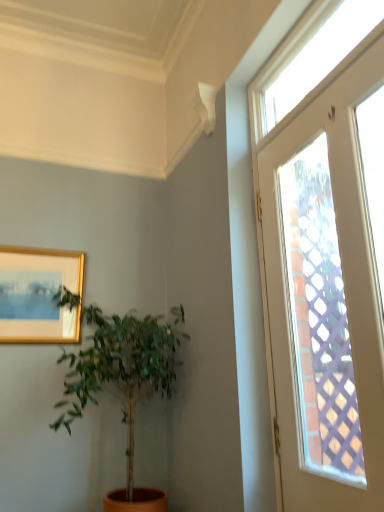
Question: From a real-world perspective, is clear glass door at upper right, the second window positioned from the top, above or below clear glass window at upper right, which is the first window in top-to-bottom order?

Choices:
 (A) below
 (B) above

Answer: (A)

Question: Is point (286, 404) closer or farther from the camera than point (352, 4)?

Choices:
 (A) farther
 (B) closer

Answer: (A)

Question: Which is farther from the clear glass door at upper right, acting as the first window starting from the bottom?

Choices:
 (A) green leafy plant at left
 (B) gold-framed picture at upper left
 (C) clear glass window at upper right, which is the first window in top-to-bottom order

Answer: (B)

Question: Which is farther from the clear glass door at upper right, acting as the first window starting from the bottom?

Choices:
 (A) clear glass window at upper right, the second window when ordered from bottom to top
 (B) gold-framed picture at upper left
 (C) green leafy plant at left

Answer: (B)